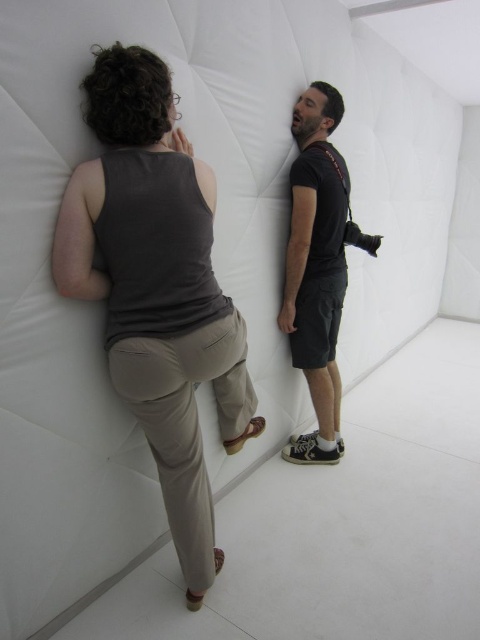
You are designing a fashion catalog and need to decide which clothing item to feature based on length. Given the scene where two people are inside a white inflatable structure, which clothing item is shorter between the matte gray tank top at upper left and the black matte shirt at center?

The matte gray tank top at upper left is shorter than the black matte shirt at center.

You are a photographer trying to capture a photo of both the matte gray tank top at upper left and the black matte shirt at center. Since you want to include both in the frame, which direction should you position your camera relative to the two items?

The matte gray tank top at upper left is positioned on the left side of the black matte shirt at center, so you should position your camera to the right side of the black matte shirt at center to include both items in the frame.